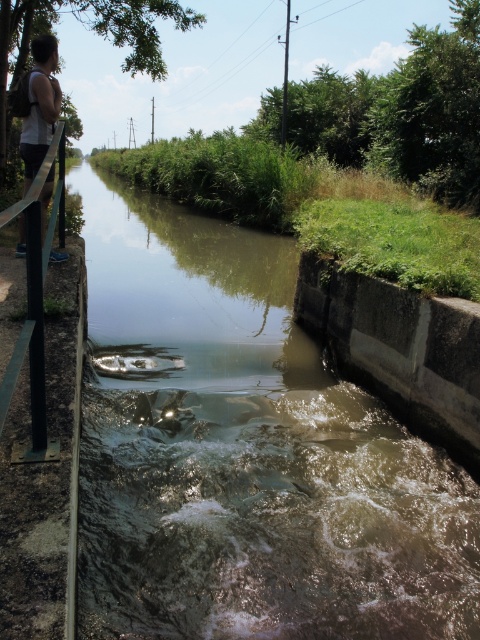
You are a drone operator trying to capture aerial footage of the canal. You have two points marked on your screen, point (451, 504) and point (41, 131). Which point should you prioritize if you want to film the calmer section of the canal first?

The point closer to the camera, which is point (451, 504), is in the calmer section of the canal. Therefore, prioritize filming point (451, 504) first to capture the calmer section.

You are a boat operator who needs to navigate a small boat through the canal. The boat requires at least 1 meter of clear water to pass safely. Given the presence of the brown murky water at center and the white fabric at left, which area should you avoid to ensure safe passage?

You should avoid the brown murky water at center because it is to the right of the white fabric at left, indicating it may be part of the turbulent section of the canal where the water is not clear enough for safe passage.